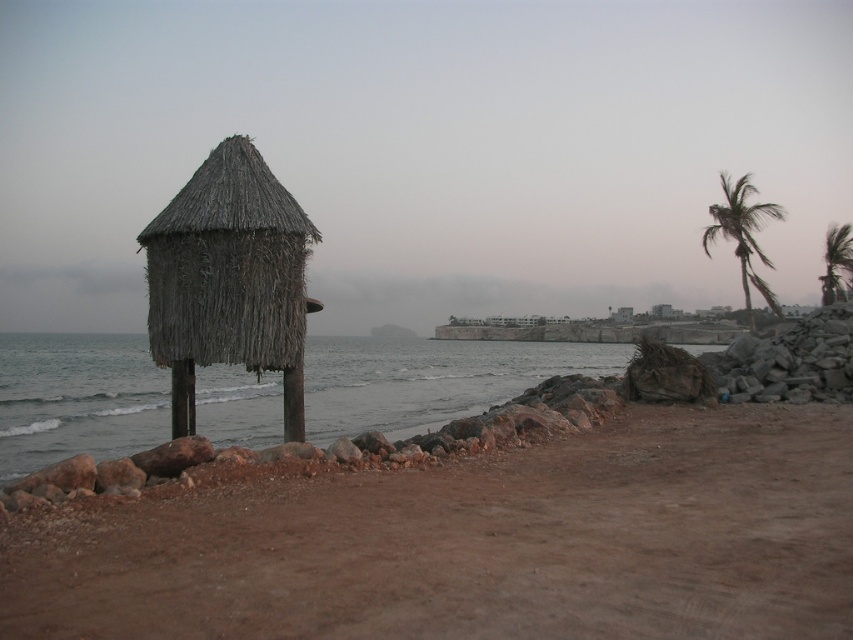
You are a hiker who wants to take a photo of both the green leafy palm tree at right and the green leafy palm tree at upper right in the same frame. Given that your camera has a maximum zoom range of 20 meters, can you capture both trees in one photo without moving your position?

The distance between the green leafy palm tree at right and the green leafy palm tree at upper right is 19.49 meters. Since your camera can zoom up to 20 meters, you can capture both trees in one photo without moving.